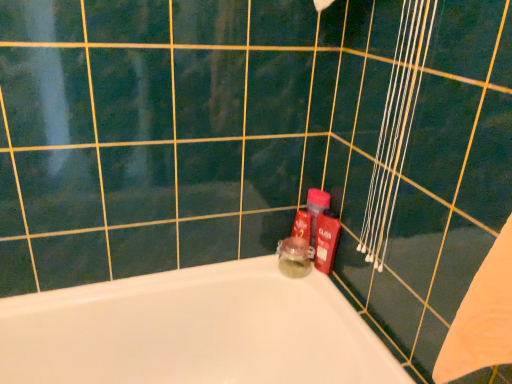
This screenshot has height=384, width=512. What do you see at coordinates (326, 240) in the screenshot?
I see `shiny plastic bottle at right, which is the first toiletry in right-to-left order` at bounding box center [326, 240].

This screenshot has width=512, height=384. In order to click on white glossy bathtub at lower left in this screenshot , I will do `click(194, 331)`.

What are the coordinates of `translucent glass jar at center, which is the 2th toiletry from right to left` in the screenshot? It's located at (294, 257).

The height and width of the screenshot is (384, 512). In order to click on shiny plastic bottle at right, marked as the 2th toiletry in a left-to-right arrangement in this screenshot , I will do `click(326, 240)`.

From the picture: From the image's perspective, between white glossy bathtub at lower left and translucent glass jar at center, which is the 2th toiletry from right to left, which one is located above?

translucent glass jar at center, which is the 2th toiletry from right to left, from the image's perspective.

Is white glossy bathtub at lower left oriented away from translucent glass jar at center, acting as the 1th toiletry starting from the left?

That's not correct — white glossy bathtub at lower left is not looking away from translucent glass jar at center, acting as the 1th toiletry starting from the left.

From a real-world perspective, is white glossy bathtub at lower left positioned under translucent glass jar at center, which is the 2th toiletry from right to left, based on gravity?

Yes.

Image resolution: width=512 pixels, height=384 pixels. In order to click on toiletry that is above the translucent glass jar at center, which is the 2th toiletry from right to left (from a real-world perspective) in this screenshot , I will do `click(326, 240)`.

From the image's perspective, which one is positioned higher, shiny plastic bottle at right, marked as the 2th toiletry in a left-to-right arrangement, or translucent glass jar at center, acting as the 1th toiletry starting from the left?

shiny plastic bottle at right, marked as the 2th toiletry in a left-to-right arrangement.

Considering the relative positions of shiny plastic bottle at right, which is the first toiletry in right-to-left order, and translucent glass jar at center, acting as the 1th toiletry starting from the left, in the image provided, is shiny plastic bottle at right, which is the first toiletry in right-to-left order, to the left of translucent glass jar at center, acting as the 1th toiletry starting from the left, from the viewer's perspective?

No, shiny plastic bottle at right, which is the first toiletry in right-to-left order, is not to the left of translucent glass jar at center, acting as the 1th toiletry starting from the left.

Is shiny plastic bottle at right, which is the first toiletry in right-to-left order, aimed at translucent glass jar at center, which is the 2th toiletry from right to left?

No, shiny plastic bottle at right, which is the first toiletry in right-to-left order, is not turned towards translucent glass jar at center, which is the 2th toiletry from right to left.

Based on their positions, is white glossy bathtub at lower left located to the left or right of shiny plastic bottle at right, marked as the 2th toiletry in a left-to-right arrangement?

white glossy bathtub at lower left is positioned on shiny plastic bottle at right, marked as the 2th toiletry in a left-to-right arrangement,'s left side.

Are white glossy bathtub at lower left and shiny plastic bottle at right, marked as the 2th toiletry in a left-to-right arrangement, making contact?

white glossy bathtub at lower left and shiny plastic bottle at right, marked as the 2th toiletry in a left-to-right arrangement, are clearly separated.

Considering the sizes of objects white glossy bathtub at lower left and shiny plastic bottle at right, marked as the 2th toiletry in a left-to-right arrangement, in the image provided, who is bigger, white glossy bathtub at lower left or shiny plastic bottle at right, marked as the 2th toiletry in a left-to-right arrangement,?

white glossy bathtub at lower left.

Is white glossy bathtub at lower left closer to the viewer compared to shiny plastic bottle at right, marked as the 2th toiletry in a left-to-right arrangement?

Yes, white glossy bathtub at lower left is closer to the camera.

Identify the location of toiletry located behind the shiny plastic bottle at right, which is the first toiletry in right-to-left order. (294, 257).

Is translucent glass jar at center, acting as the 1th toiletry starting from the left, positioned with its back to shiny plastic bottle at right, which is the first toiletry in right-to-left order?

That's not correct — translucent glass jar at center, acting as the 1th toiletry starting from the left, is not looking away from shiny plastic bottle at right, which is the first toiletry in right-to-left order.

Can you tell me how much translucent glass jar at center, which is the 2th toiletry from right to left, and shiny plastic bottle at right, which is the first toiletry in right-to-left order, differ in facing direction?

They differ by 1.48 degrees in their facing directions.

Which of these two, translucent glass jar at center, acting as the 1th toiletry starting from the left, or shiny plastic bottle at right, which is the first toiletry in right-to-left order, is bigger?

Bigger between the two is translucent glass jar at center, acting as the 1th toiletry starting from the left.

From a real-world perspective, between shiny plastic bottle at right, which is the first toiletry in right-to-left order, and white glossy bathtub at lower left, who is vertically lower?

white glossy bathtub at lower left.

Measure the distance from shiny plastic bottle at right, marked as the 2th toiletry in a left-to-right arrangement, to white glossy bathtub at lower left.

shiny plastic bottle at right, marked as the 2th toiletry in a left-to-right arrangement, and white glossy bathtub at lower left are 17.19 inches apart from each other.

Can you see shiny plastic bottle at right, marked as the 2th toiletry in a left-to-right arrangement, touching white glossy bathtub at lower left?

No, shiny plastic bottle at right, marked as the 2th toiletry in a left-to-right arrangement, is not in contact with white glossy bathtub at lower left.

In the scene shown: Is shiny plastic bottle at right, which is the first toiletry in right-to-left order, positioned beyond the bounds of white glossy bathtub at lower left?

Yes, shiny plastic bottle at right, which is the first toiletry in right-to-left order, is not within white glossy bathtub at lower left.

Is translucent glass jar at center, acting as the 1th toiletry starting from the left, situated inside white glossy bathtub at lower left or outside?

translucent glass jar at center, acting as the 1th toiletry starting from the left, lies outside white glossy bathtub at lower left.

Consider the image. Is translucent glass jar at center, which is the 2th toiletry from right to left, at the left side of white glossy bathtub at lower left?

No, translucent glass jar at center, which is the 2th toiletry from right to left, is not to the left of white glossy bathtub at lower left.

Is translucent glass jar at center, which is the 2th toiletry from right to left, shorter than white glossy bathtub at lower left?

Yes, translucent glass jar at center, which is the 2th toiletry from right to left, is shorter than white glossy bathtub at lower left.

Are translucent glass jar at center, which is the 2th toiletry from right to left, and white glossy bathtub at lower left located far from each other?

Actually, translucent glass jar at center, which is the 2th toiletry from right to left, and white glossy bathtub at lower left are a little close together.

Locate an element on the screen. The width and height of the screenshot is (512, 384). bathtub on the left side of translucent glass jar at center, acting as the 1th toiletry starting from the left is located at coordinates (194, 331).

Locate an element on the screen. toiletry located behind the shiny plastic bottle at right, which is the first toiletry in right-to-left order is located at coordinates (294, 257).

Based on their spatial positions, is white glossy bathtub at lower left or shiny plastic bottle at right, marked as the 2th toiletry in a left-to-right arrangement, closer to translucent glass jar at center, acting as the 1th toiletry starting from the left?

shiny plastic bottle at right, marked as the 2th toiletry in a left-to-right arrangement, is positioned closer to the anchor translucent glass jar at center, acting as the 1th toiletry starting from the left.

When comparing their distances from white glossy bathtub at lower left, does translucent glass jar at center, which is the 2th toiletry from right to left, or shiny plastic bottle at right, marked as the 2th toiletry in a left-to-right arrangement, seem further?

shiny plastic bottle at right, marked as the 2th toiletry in a left-to-right arrangement, is positioned further to the anchor white glossy bathtub at lower left.

Considering their positions, is shiny plastic bottle at right, which is the first toiletry in right-to-left order, positioned further to translucent glass jar at center, which is the 2th toiletry from right to left, than white glossy bathtub at lower left?

Among the two, white glossy bathtub at lower left is located further to translucent glass jar at center, which is the 2th toiletry from right to left.

Consider the image. Which object lies nearer to the anchor point white glossy bathtub at lower left, shiny plastic bottle at right, marked as the 2th toiletry in a left-to-right arrangement, or translucent glass jar at center, acting as the 1th toiletry starting from the left?

Among the two, translucent glass jar at center, acting as the 1th toiletry starting from the left, is located nearer to white glossy bathtub at lower left.

From the image, which object appears to be nearer to shiny plastic bottle at right, which is the first toiletry in right-to-left order, translucent glass jar at center, which is the 2th toiletry from right to left, or white glossy bathtub at lower left?

translucent glass jar at center, which is the 2th toiletry from right to left.

When comparing their distances from shiny plastic bottle at right, which is the first toiletry in right-to-left order, does white glossy bathtub at lower left or translucent glass jar at center, which is the 2th toiletry from right to left, seem closer?

translucent glass jar at center, which is the 2th toiletry from right to left, is closer to shiny plastic bottle at right, which is the first toiletry in right-to-left order.

You are a GUI agent. You are given a task and a screenshot of the screen. Output one action in this format:
    pyautogui.click(x=<x>, y=<y>)
    Task: Click on the toiletry positioned between white glossy bathtub at lower left and translucent glass jar at center, acting as the 1th toiletry starting from the left, from near to far
    The height and width of the screenshot is (384, 512).
    Given the screenshot: What is the action you would take?
    pyautogui.click(x=326, y=240)